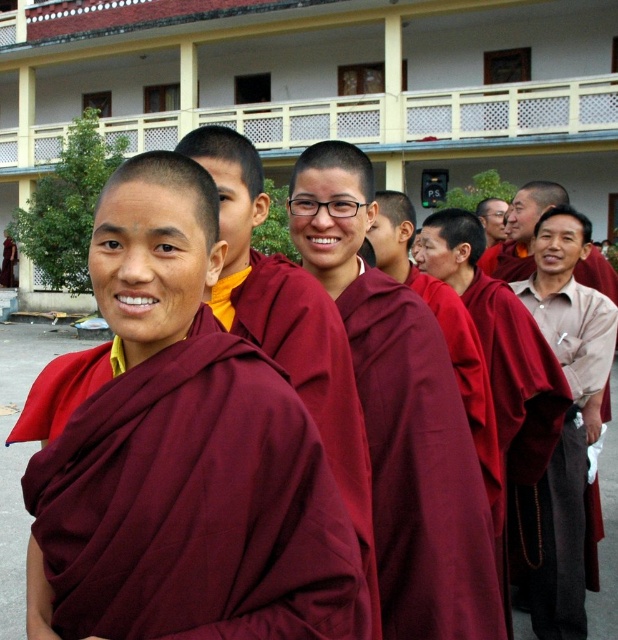
Question: Estimate the real-world distances between objects in this image. Which object is farther from the burgundy woolen robe at center?

Choices:
 (A) maroon velvet robe at right
 (B) maroon cloth at center
 (C) maroon robe at center

Answer: (A)

Question: Is burgundy woolen robe at center thinner than maroon velvet robe at right?

Choices:
 (A) no
 (B) yes

Answer: (A)

Question: Is maroon robe at center positioned in front of maroon velvet robe at right?

Choices:
 (A) no
 (B) yes

Answer: (B)

Question: Which object appears closest to the camera in this image?

Choices:
 (A) maroon cloth at center
 (B) maroon robe at center

Answer: (B)

Question: Can you confirm if burgundy woolen robe at center is positioned to the left of maroon cloth at center?

Choices:
 (A) no
 (B) yes

Answer: (B)

Question: Which point is closer to the camera taking this photo?

Choices:
 (A) (533, 580)
 (B) (205, 125)

Answer: (A)